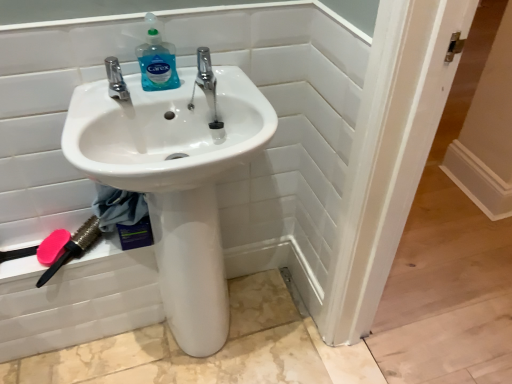
Identify the location of vacant region to the right of white glossy sink at center. (284, 327).